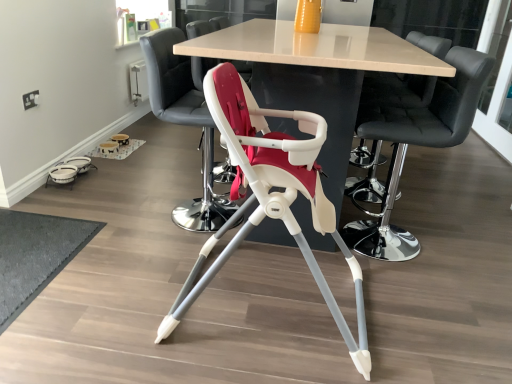
At what (x,y) coordinates should I click in order to perform the action: click on vacant space underneath matte white highchair at center, acting as the 3th chair starting from the right (from a real-world perspective). Please return your answer as a coordinate pair (x, y). The width and height of the screenshot is (512, 384). Looking at the image, I should click on (268, 303).